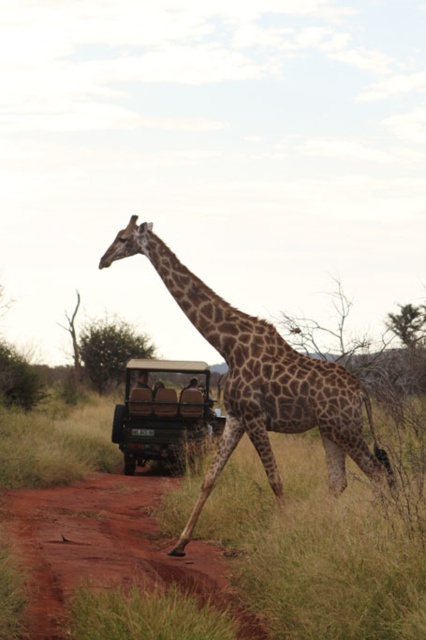
Question: Which point is closer to the camera?

Choices:
 (A) (203, 336)
 (B) (154, 502)

Answer: (A)

Question: Can you confirm if brown dirt track at lower left is bigger than brown leather jeep at center?

Choices:
 (A) no
 (B) yes

Answer: (B)

Question: Does spotted brown giraffe at center appear on the left side of brown leather jeep at center?

Choices:
 (A) yes
 (B) no

Answer: (B)

Question: Based on their relative distances, which object is farther from the brown leather jeep at center?

Choices:
 (A) spotted brown giraffe at center
 (B) brown dirt track at lower left
 (C) green grass at center

Answer: (A)

Question: Which point is closer to the camera?

Choices:
 (A) 365,516
 (B) 178,284

Answer: (A)

Question: Is green grass at center thinner than spotted brown giraffe at center?

Choices:
 (A) no
 (B) yes

Answer: (A)